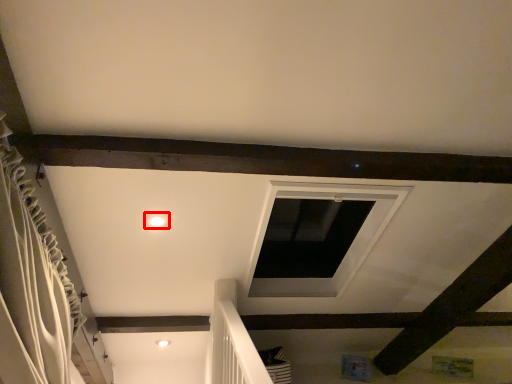
Question: In this image, where is lighting (annotated by the red box) located relative to curtain?

Choices:
 (A) right
 (B) left

Answer: (A)